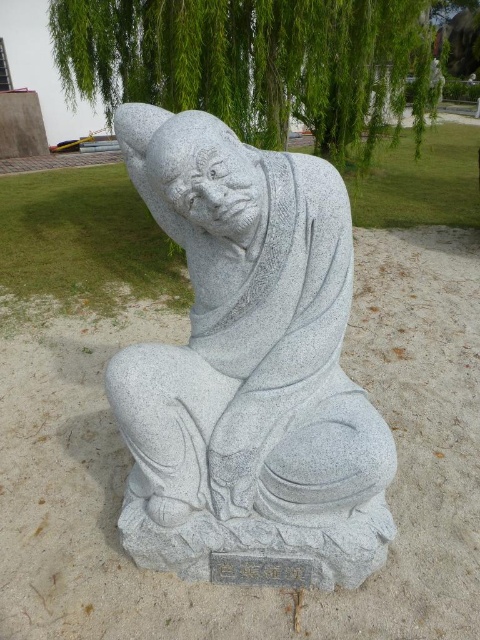
You are a photographer wanting to capture the gray stone statue at center and the green leafy tree at upper center in a single shot. Based on their positions, which object should you focus on first to ensure both are in frame?

The gray stone statue at center is below the green leafy tree at upper center, so you should focus on the green leafy tree at upper center first to ensure both are in frame.

You are standing at the entrance of the park and want to find the gray stone statue at center. According to the map, your current position is at point A, and the statue is marked at point B. What direction should you move to reach the statue?

The gray stone statue at center is located at point B, so you should move towards point B from point A to reach it.